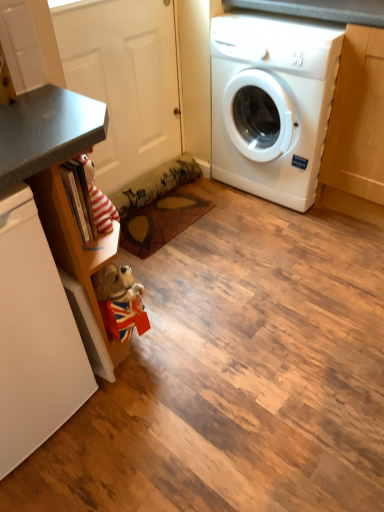
What are the coordinates of `vacant space to the right of white matte dishwasher at left` in the screenshot? It's located at (150, 398).